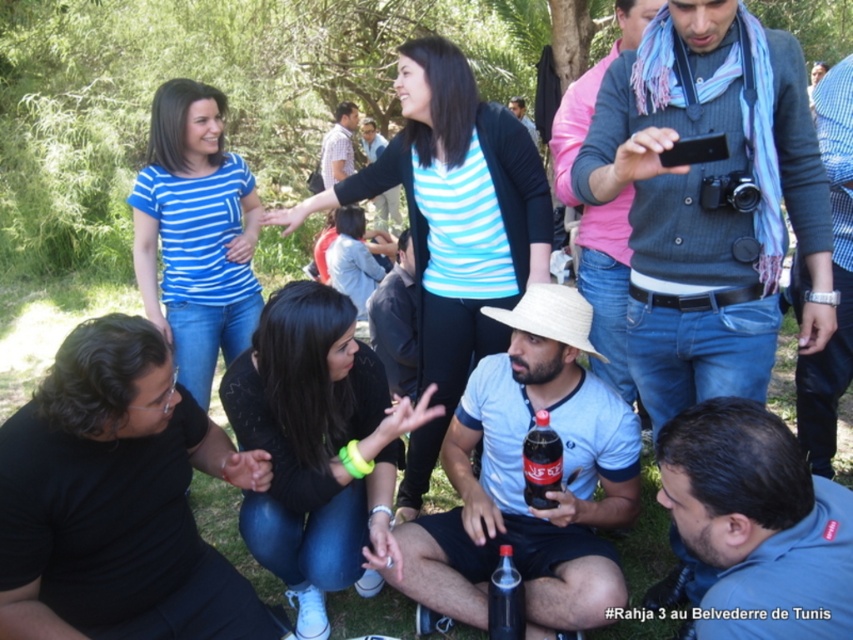
Can you confirm if black matte shirt at lower left is positioned above light blue shirt at center?

No.

You are a GUI agent. You are given a task and a screenshot of the screen. Output one action in this format:
    pyautogui.click(x=<x>, y=<y>)
    Task: Click on the black matte shirt at lower left
    
    Given the screenshot: What is the action you would take?
    pyautogui.click(x=117, y=499)

Who is positioned more to the left, dark red glass coca-cola at center or light blue striped shirt at center?

light blue striped shirt at center is more to the left.

Between point (541, 493) and point (378, 196), which one is positioned in front?

Point (541, 493) is in front.

Identify the location of dark red glass coca-cola at center. The image size is (853, 640). 541,461.

Can you confirm if light blue cotton shirt at center is positioned to the right of white striped shirt at upper center?

Indeed, light blue cotton shirt at center is positioned on the right side of white striped shirt at upper center.

Does light blue cotton shirt at center have a larger size compared to white striped shirt at upper center?

Actually, light blue cotton shirt at center might be smaller than white striped shirt at upper center.

Identify the location of light blue cotton shirt at center. The image size is (853, 640). (521, 477).